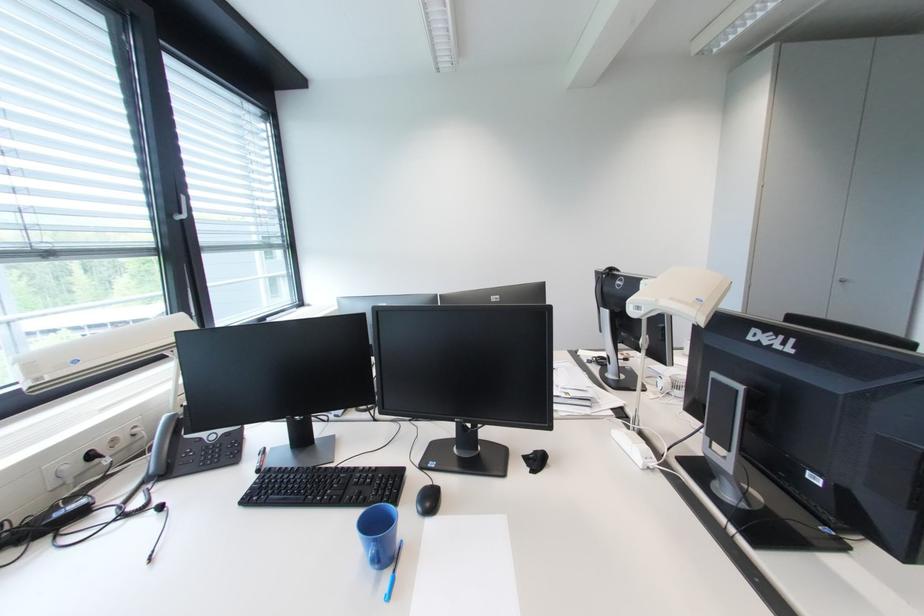
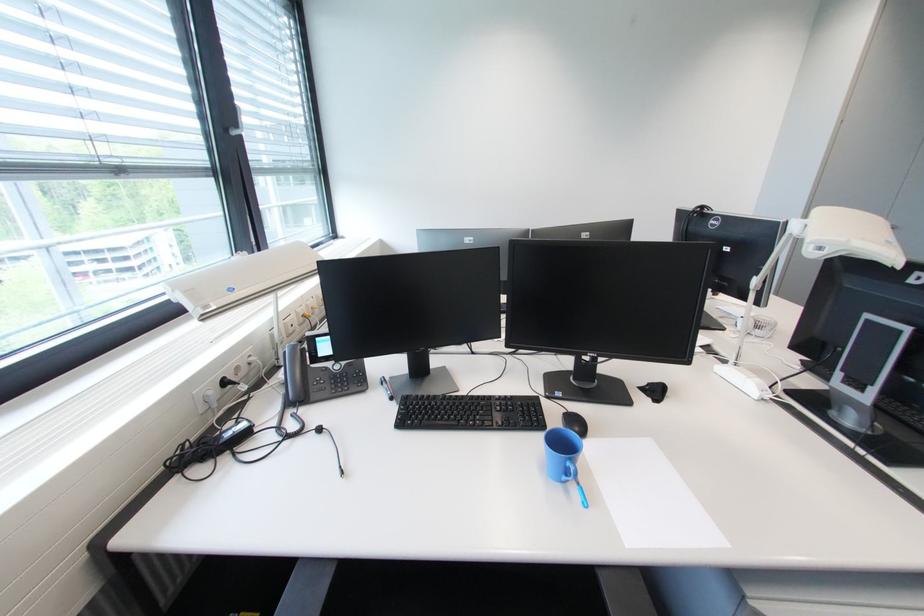
Locate, in the second image, the point that corresponds to pixel 438 485 in the first image.

(573, 411)